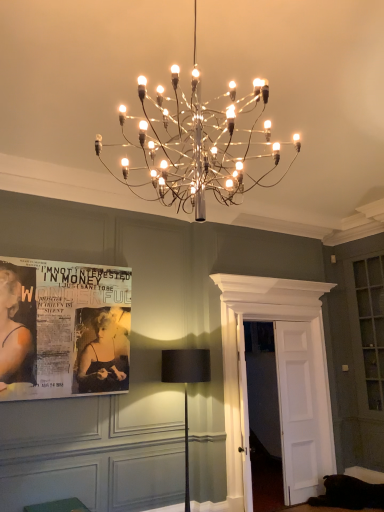
Question: Is point (114, 296) positioned closer to the camera than point (129, 144)?

Choices:
 (A) farther
 (B) closer

Answer: (A)

Question: Which is correct: black paper poster at left is inside metallic wire chandelier at upper center, the second lamp in the back-to-front sequence, or outside of it?

Choices:
 (A) inside
 (B) outside

Answer: (B)

Question: Which object is positioned farthest from the green fabric cushion at lower left?

Choices:
 (A) metallic wire chandelier at upper center, which is the 2th lamp in bottom-to-top order
 (B) black paper poster at left
 (C) black fabric lamp at center, which is the second lamp in front-to-back order

Answer: (A)

Question: Which object is positioned farthest from the black paper poster at left?

Choices:
 (A) black fabric lamp at center, which is counted as the first lamp, starting from the bottom
 (B) green fabric cushion at lower left
 (C) metallic wire chandelier at upper center, the second lamp in the back-to-front sequence

Answer: (C)